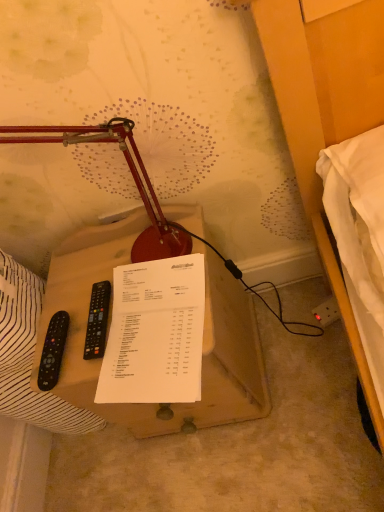
Locate an element on the screen. vacant area located to the right-hand side of black plastic remote control at left, which is the 1th remote control in right-to-left order is located at coordinates (155, 303).